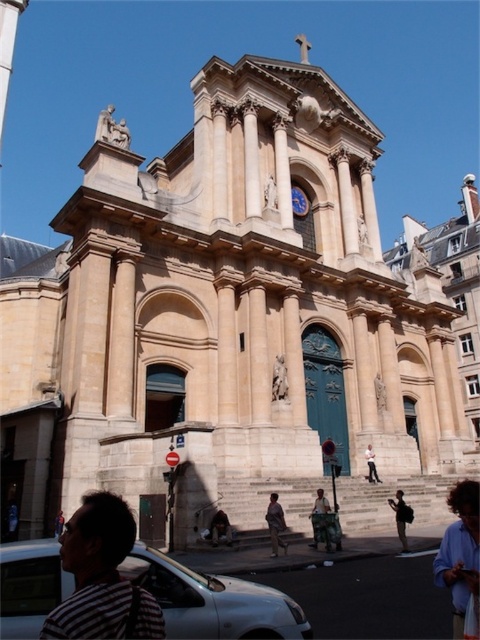
Which is more to the left, matte silver car at lower left or striped fabric at lower left?

striped fabric at lower left is more to the left.

The width and height of the screenshot is (480, 640). What are the coordinates of `matte silver car at lower left` in the screenshot? It's located at (213, 600).

Is matte silver car at lower left in front of beige stone church at right?

Yes, it is.

Is matte silver car at lower left smaller than beige stone church at right?

Indeed, matte silver car at lower left has a smaller size compared to beige stone church at right.

Who is more distant from viewer, (x=163, y=573) or (x=459, y=301)?

The point (x=459, y=301) is more distant.

At what (x,y) coordinates should I click in order to perform the action: click on matte silver car at lower left. Please return your answer as a coordinate pair (x, y). Looking at the image, I should click on (213, 600).

Based on the photo, does matte silver car at lower left lie behind brown leather jacket at lower center?

That is False.

Is matte silver car at lower left closer to the viewer compared to brown leather jacket at lower center?

Yes, matte silver car at lower left is closer to the viewer.

Is point (26, 618) positioned behind point (228, 531)?

No.

Where is `matte silver car at lower left`? matte silver car at lower left is located at coordinates (213, 600).